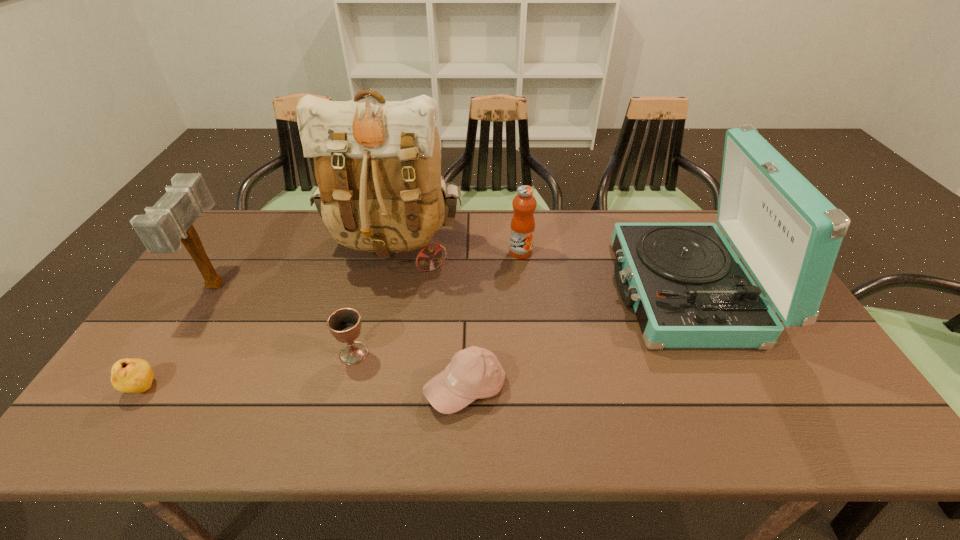
At what (x,y) coordinates should I click in order to perform the action: click on vacant region between the fruit juice and the baseball cap. Please return your answer as a coordinate pair (x, y). This screenshot has height=540, width=960. Looking at the image, I should click on (493, 320).

You are a GUI agent. You are given a task and a screenshot of the screen. Output one action in this format:
    pyautogui.click(x=<x>, y=<y>)
    Task: Click on the second closest object to the pear
    The height and width of the screenshot is (540, 960).
    Given the screenshot: What is the action you would take?
    pyautogui.click(x=377, y=164)

Identify the location of the fifth closest object to the fourth tallest object. The height and width of the screenshot is (540, 960). (169, 222).